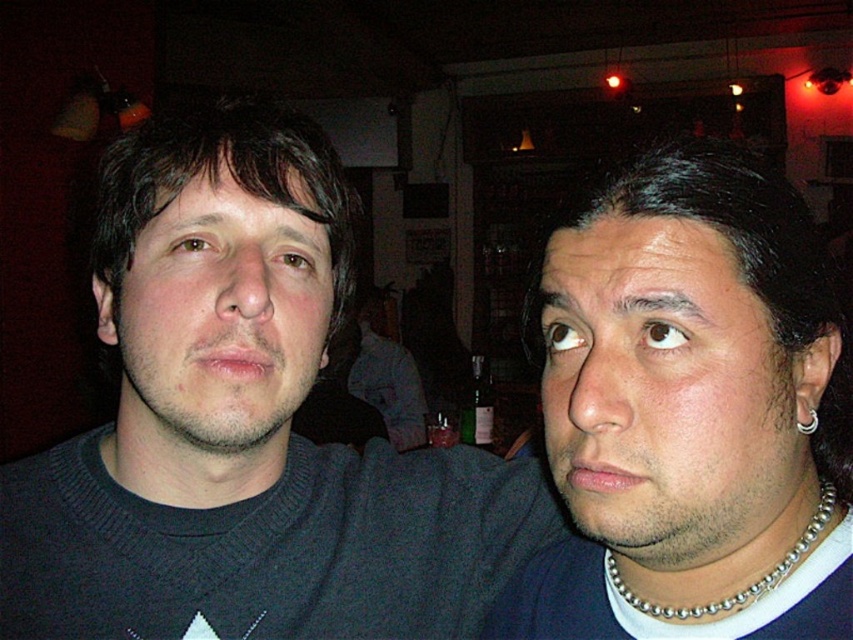
From the picture: You are at a social event and want to compliment someone on their jewelry. You see a smooth silver necklace at right and a point at coordinate (x=689, y=412). Which one is the actual jewelry you should mention?

The smooth silver necklace at right is the actual jewelry located at point (x=689, y=412).

Consider the image. You are planning to take a photo of the dark gray sweater at center and the silver metallic ring at right ear. Which object should you focus on first if you want to capture both in the frame without moving the camera?

The dark gray sweater at center is wider than the silver metallic ring at right ear, so you should focus on the dark gray sweater at center first to ensure it fits within the frame.

You are a photographer trying to adjust the lighting for a photo shoot. You want to ensure that the dark gray sweater at center is well lit. Based on the scene description, where should you place the light source relative to the sweater?

The dark gray sweater at center is positioned at point (242, 426). To ensure proper lighting, the light source should be placed in front of the sweater to illuminate it effectively.